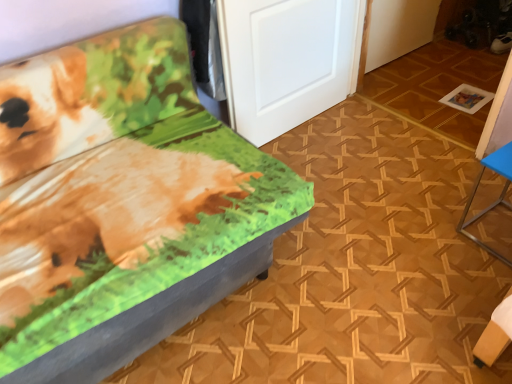
In order to click on white matte door at center in this screenshot , I will do click(286, 60).

The width and height of the screenshot is (512, 384). In order to click on white matte door at center in this screenshot , I will do `click(286, 60)`.

Could you measure the distance between printed fabric bench at left, the first furniture from the left, and blue metallic table at right, which is the first furniture in right-to-left order?

printed fabric bench at left, the first furniture from the left, and blue metallic table at right, which is the first furniture in right-to-left order, are 4.23 feet apart.

Does printed fabric bench at left, the first furniture from the left, have a greater height compared to blue metallic table at right, which is the 2th furniture from left to right?

Yes, printed fabric bench at left, the first furniture from the left, is taller than blue metallic table at right, which is the 2th furniture from left to right.

Who is smaller, printed fabric bench at left, the first furniture from the left, or blue metallic table at right, which is the first furniture in right-to-left order?

With smaller size is blue metallic table at right, which is the first furniture in right-to-left order.

From the image's perspective, which one is positioned higher, printed fabric bench at left, the first furniture from the left, or blue metallic table at right, which is the 2th furniture from left to right?

printed fabric bench at left, the first furniture from the left, appears higher in the image.

Is blue metallic table at right, which is the 2th furniture from left to right, looking in the opposite direction of white matte door at center?

No, blue metallic table at right, which is the 2th furniture from left to right,'s orientation is not away from white matte door at center.

Which is more to the right, blue metallic table at right, which is the first furniture in right-to-left order, or white matte door at center?

blue metallic table at right, which is the first furniture in right-to-left order.

Where is `door above the blue metallic table at right, which is the 2th furniture from left to right (from a real-world perspective)`? door above the blue metallic table at right, which is the 2th furniture from left to right (from a real-world perspective) is located at coordinates (286, 60).

Is blue metallic table at right, which is the 2th furniture from left to right, thinner than white matte door at center?

No.

Considering the positions of point (311, 76) and point (482, 167), is point (311, 76) closer or farther from the camera than point (482, 167)?

Point (311, 76).

Is white matte door at center not near blue metallic table at right, which is the first furniture in right-to-left order?

Indeed, white matte door at center is not near blue metallic table at right, which is the first furniture in right-to-left order.

Does white matte door at center have a greater height compared to blue metallic table at right, which is the first furniture in right-to-left order?

Yes.

Is white matte door at center spatially inside blue metallic table at right, which is the 2th furniture from left to right, or outside of it?

white matte door at center lies outside blue metallic table at right, which is the 2th furniture from left to right.

From a real-world perspective, is white matte door at center positioned above or below printed fabric bench at left, the first furniture from the left?

In terms of real-world spatial position, white matte door at center is above printed fabric bench at left, the first furniture from the left.

Which is in front, point (336, 62) or point (99, 352)?

Point (99, 352)

Locate an element on the screen. This screenshot has width=512, height=384. door located above the printed fabric bench at left, which is the 2th furniture in right-to-left order (from a real-world perspective) is located at coordinates (286, 60).

What's the angular difference between blue metallic table at right, which is the first furniture in right-to-left order, and printed fabric bench at left, the first furniture from the left,'s facing directions?

blue metallic table at right, which is the first furniture in right-to-left order, and printed fabric bench at left, the first furniture from the left, are facing 92.8 degrees away from each other.

Is blue metallic table at right, which is the 2th furniture from left to right, facing towards printed fabric bench at left, the first furniture from the left?

No, blue metallic table at right, which is the 2th furniture from left to right, is not oriented towards printed fabric bench at left, the first furniture from the left.

Which of these two, blue metallic table at right, which is the 2th furniture from left to right, or printed fabric bench at left, which is the 2th furniture in right-to-left order, is smaller?

Smaller between the two is blue metallic table at right, which is the 2th furniture from left to right.

From the image's perspective, is blue metallic table at right, which is the 2th furniture from left to right, located above printed fabric bench at left, which is the 2th furniture in right-to-left order?

No.

Would you say printed fabric bench at left, which is the 2th furniture in right-to-left order, is inside or outside white matte door at center?

printed fabric bench at left, which is the 2th furniture in right-to-left order, is not enclosed by white matte door at center.

From the image's perspective, relative to white matte door at center, is printed fabric bench at left, the first furniture from the left, above or below?

printed fabric bench at left, the first furniture from the left, is below white matte door at center.

Considering the positions of objects printed fabric bench at left, which is the 2th furniture in right-to-left order, and white matte door at center in the image provided, who is behind, printed fabric bench at left, which is the 2th furniture in right-to-left order, or white matte door at center?

white matte door at center is more distant.

From a real-world perspective, is printed fabric bench at left, the first furniture from the left, below white matte door at center?

Indeed, from a real-world perspective, printed fabric bench at left, the first furniture from the left, is positioned beneath white matte door at center.

Identify the location of furniture on the left of blue metallic table at right, which is the first furniture in right-to-left order. (122, 204).

The height and width of the screenshot is (384, 512). Identify the location of furniture that is on the right side of white matte door at center. (496, 200).

Looking at the image, which one is located closer to blue metallic table at right, which is the first furniture in right-to-left order, printed fabric bench at left, the first furniture from the left, or white matte door at center?

Among the two, white matte door at center is located nearer to blue metallic table at right, which is the first furniture in right-to-left order.

Looking at the image, which one is located further to white matte door at center, blue metallic table at right, which is the first furniture in right-to-left order, or printed fabric bench at left, which is the 2th furniture in right-to-left order?

Among the two, blue metallic table at right, which is the first furniture in right-to-left order, is located further to white matte door at center.

Based on their spatial positions, is blue metallic table at right, which is the 2th furniture from left to right, or white matte door at center closer to printed fabric bench at left, which is the 2th furniture in right-to-left order?

Based on the image, white matte door at center appears to be nearer to printed fabric bench at left, which is the 2th furniture in right-to-left order.

In the scene shown: Looking at the image, which one is located further to white matte door at center, printed fabric bench at left, the first furniture from the left, or blue metallic table at right, which is the 2th furniture from left to right?

The object further to white matte door at center is blue metallic table at right, which is the 2th furniture from left to right.

Estimate the real-world distances between objects in this image. Which object is closer to printed fabric bench at left, which is the 2th furniture in right-to-left order, white matte door at center or blue metallic table at right, which is the first furniture in right-to-left order?

white matte door at center lies closer to printed fabric bench at left, which is the 2th furniture in right-to-left order, than the other object.

Based on their spatial positions, is white matte door at center or printed fabric bench at left, the first furniture from the left, further from blue metallic table at right, which is the 2th furniture from left to right?

The object further to blue metallic table at right, which is the 2th furniture from left to right, is printed fabric bench at left, the first furniture from the left.

Identify the location of door located between printed fabric bench at left, the first furniture from the left, and blue metallic table at right, which is the 2th furniture from left to right, in the left-right direction. (286, 60).